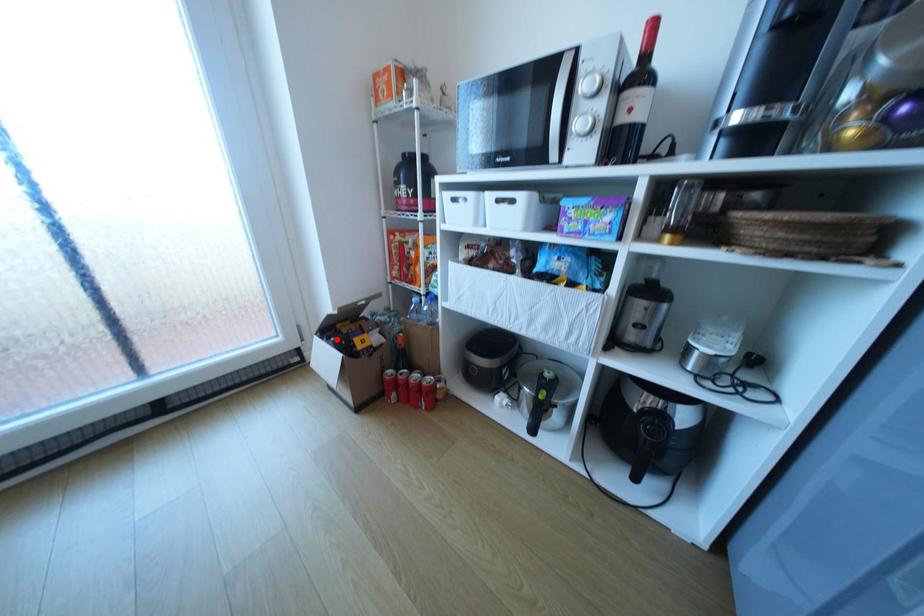
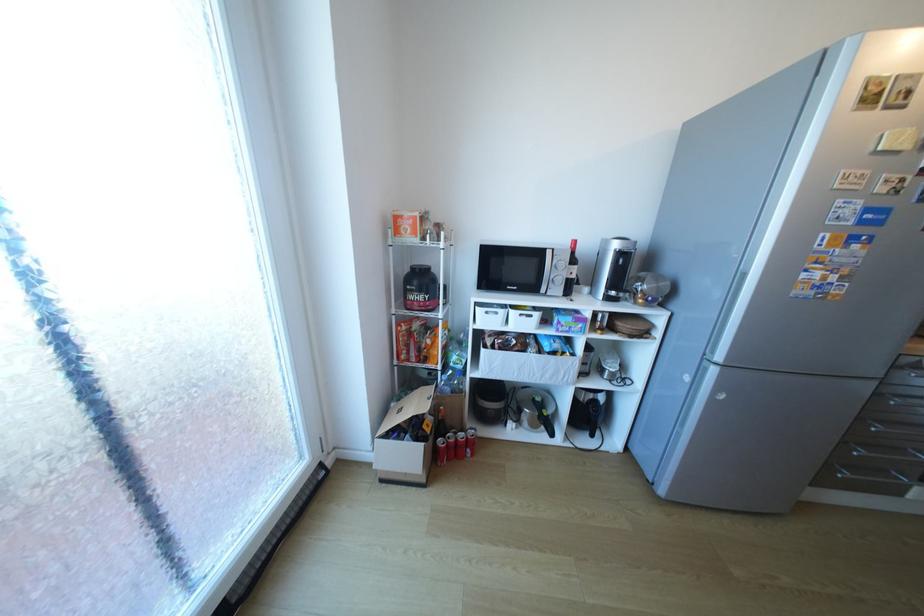
Question: A red point is marked in image1. In image2, is the corresponding 3D point closer to the camera or farther? Reply with the corresponding letter.

Choices:
 (A) The corresponding 3D point is closer.
 (B) The corresponding 3D point is farther.

Answer: (B)